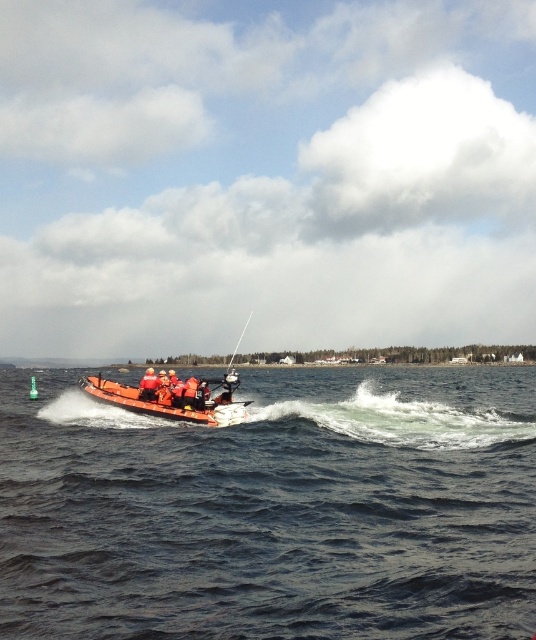
You are a drone operator trying to capture a photo of the bright orange inflatable boat in the center of the image. The drone is currently hovering at point (273, 508). Will the drone need to move north or south to get a clear shot of the boat?

The point (273, 508) is located at the dark blue water at center. Since the bright orange inflatable boat is also at the center, the drone does not need to move north or south as it is already positioned over the center area where the boat is located.

You are a rescue team member on the boat and need to reach a distress signal coming from a point ahead. There are two reference points marked on the boat for navigation. Which point should you aim for to reach the distress signal first, point (x=531, y=561) or point (x=202, y=388)?

You should aim for point (x=531, y=561) because it is in front of point (x=202, y=388), so it is closer to the direction of the distress signal.